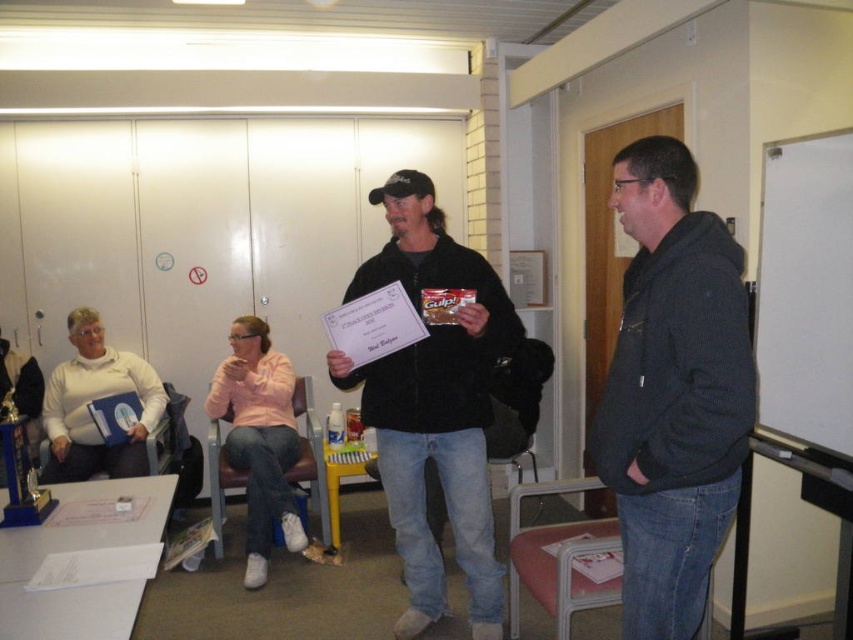
Question: Is dark gray hoodie at right bigger than black matte jacket at center?

Choices:
 (A) yes
 (B) no

Answer: (B)

Question: Which object appears closest to the camera in this image?

Choices:
 (A) white matte board at right
 (B) black matte jacket at center

Answer: (A)

Question: Can you confirm if black matte jacket at center is positioned below white matte board at right?

Choices:
 (A) no
 (B) yes

Answer: (B)

Question: Is black matte jacket at center bigger than white matte board at right?

Choices:
 (A) no
 (B) yes

Answer: (B)

Question: Which point is farther to the camera?

Choices:
 (A) (834, 180)
 (B) (482, 545)

Answer: (B)

Question: Which of these objects is positioned closest to the black matte jacket at center?

Choices:
 (A) white matte board at right
 (B) dark gray hoodie at right

Answer: (B)